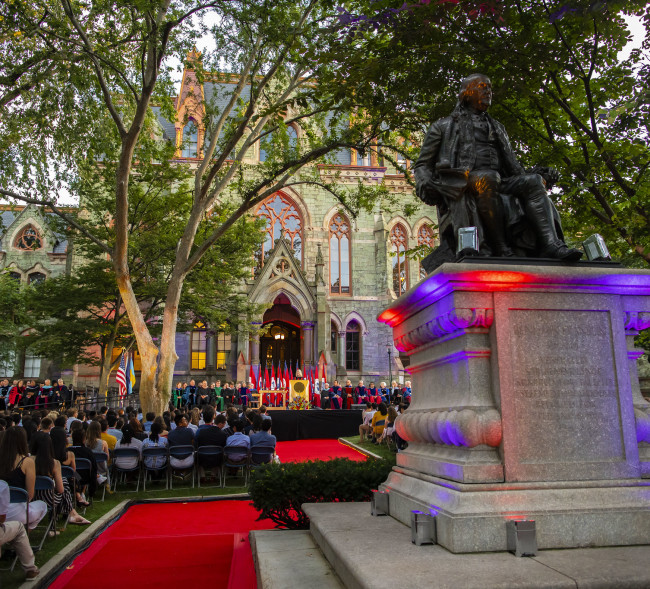
Find the location of a particular element. 2 stairs is located at coordinates (296, 565), (374, 535).